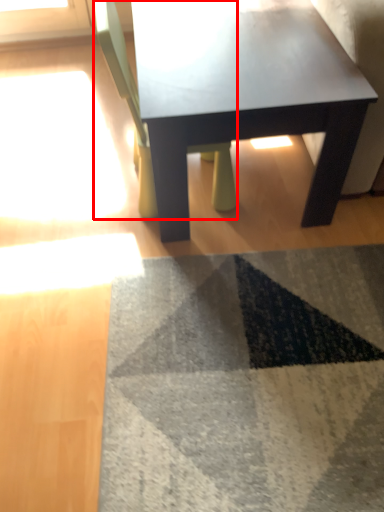
Question: Considering the relative positions of chair (annotated by the red box) and coffee table in the image provided, where is chair (annotated by the red box) located with respect to the staircase?

Choices:
 (A) right
 (B) left

Answer: (B)